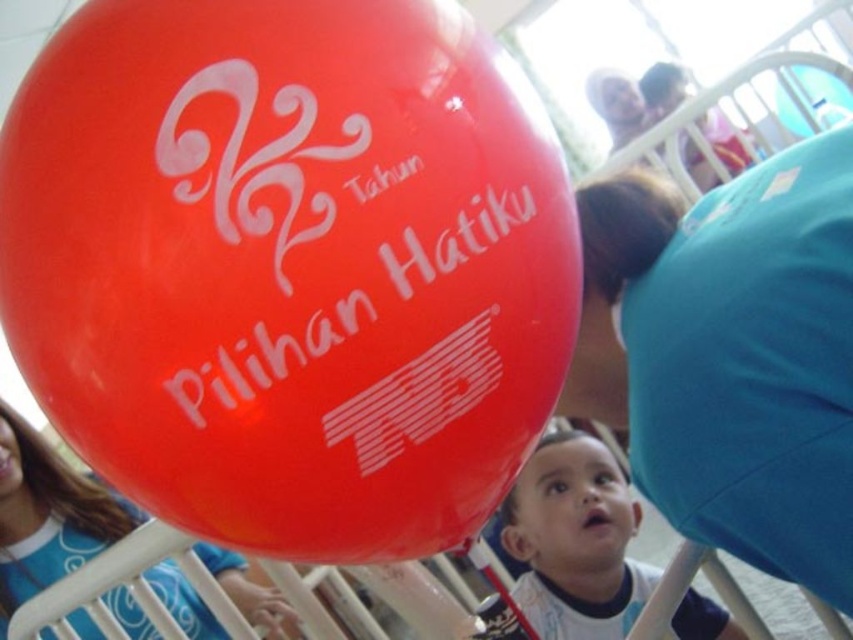
You are a photographer trying to capture a clear shot of the smooth skin baby at center without the glossy rubber balloon at upper left blocking the view. Given their sizes, can you zoom in enough to focus on the baby while avoiding the balloon?

The glossy rubber balloon at upper left is larger than the smooth skin baby at center. Therefore, zooming in might still leave part of the balloon in frame, but focusing on the baby could be possible if the balloon isn not directly overlapping.

You are standing in front of the large red balloon and want to touch one of the two points marked on it. The first point is at coordinates point (323, 90) and the second point is at point (511, 509). Which point would require you to reach out less to touch it?

Point (323, 90) is closer to the viewer than point (511, 509), so you would need to reach out less to touch point (323, 90).

You are standing in a room where the glossy rubber balloon at upper left and the matte blue shirt at lower left are present. Which object is positioned higher from the ground?

The glossy rubber balloon at upper left is positioned higher from the ground than the matte blue shirt at lower left because it is located above it.